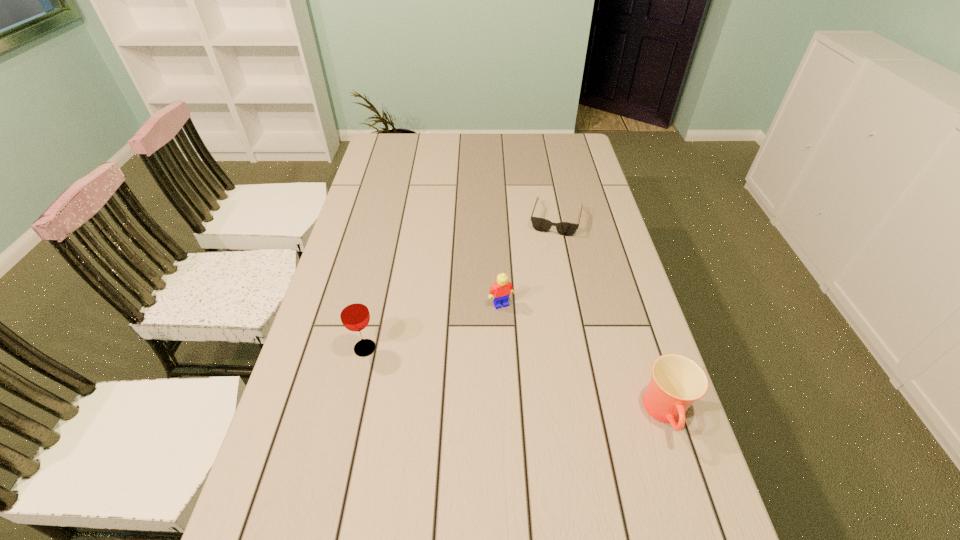
Locate an element on the screen. The width and height of the screenshot is (960, 540). free space located at the front lenses of the third object from left to right is located at coordinates (531, 321).

Where is `free space located at the front lenses of the third object from left to right`? The width and height of the screenshot is (960, 540). free space located at the front lenses of the third object from left to right is located at coordinates (545, 265).

Where is `vacant space located at the front lenses of the third object from left to right`? vacant space located at the front lenses of the third object from left to right is located at coordinates (538, 295).

Image resolution: width=960 pixels, height=540 pixels. What are the coordinates of `free location located on the front-facing side of the Lego` in the screenshot? It's located at (555, 409).

At what (x,y) coordinates should I click in order to perform the action: click on vacant space positioned on the front-facing side of the Lego. Please return your answer as a coordinate pair (x, y). The width and height of the screenshot is (960, 540). Looking at the image, I should click on (524, 348).

Identify the location of free space located on the front-facing side of the Lego. The image size is (960, 540). (524, 348).

At what (x,y) coordinates should I click in order to perform the action: click on object at the left edge. Please return your answer as a coordinate pair (x, y). The height and width of the screenshot is (540, 960). Looking at the image, I should click on (354, 313).

You are a GUI agent. You are given a task and a screenshot of the screen. Output one action in this format:
    pyautogui.click(x=<x>, y=<y>)
    Task: Click on the cup situated at the right edge
    This screenshot has height=540, width=960.
    Given the screenshot: What is the action you would take?
    pyautogui.click(x=677, y=381)

You are a GUI agent. You are given a task and a screenshot of the screen. Output one action in this format:
    pyautogui.click(x=<x>, y=<y>)
    Task: Click on the sunglasses that is at the right edge
    The height and width of the screenshot is (540, 960).
    Given the screenshot: What is the action you would take?
    click(540, 224)

The image size is (960, 540). What are the coordinates of `vacant space at the far edge of the desktop` in the screenshot? It's located at (541, 156).